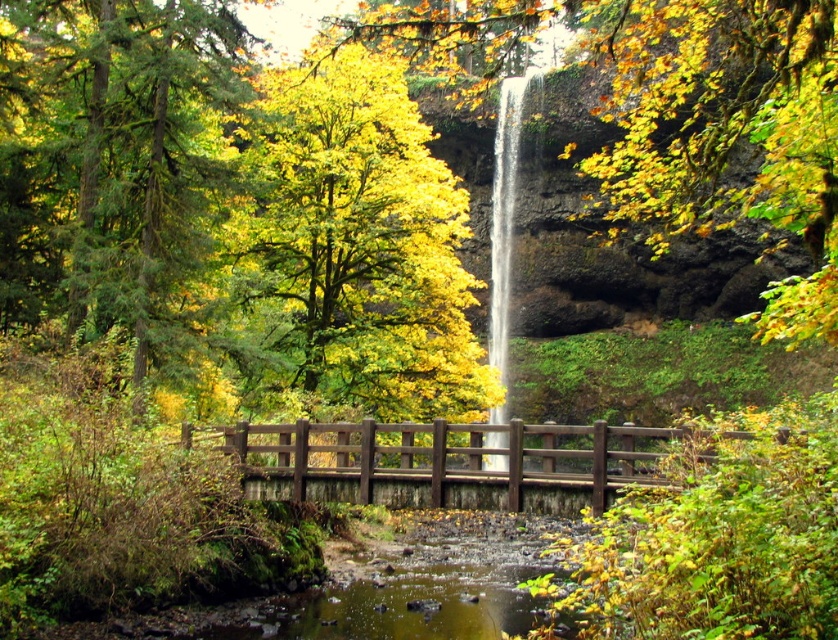
Question: Which point is farther to the camera?

Choices:
 (A) white smooth waterfall at center
 (B) yellow/golden leaves at center
 (C) yellow leafy tree at center
 (D) brown wooden bridge at center

Answer: (B)

Question: Which object is the closest to the brown wooden bridge at center?

Choices:
 (A) yellow/golden leaves at center
 (B) white smooth waterfall at center

Answer: (B)

Question: Does yellow leafy tree at center appear over white smooth waterfall at center?

Choices:
 (A) no
 (B) yes

Answer: (B)

Question: Is yellow leafy tree at center below brown wooden bridge at center?

Choices:
 (A) no
 (B) yes

Answer: (A)

Question: Does yellow leafy tree at center have a smaller size compared to yellow/golden leaves at center?

Choices:
 (A) yes
 (B) no

Answer: (B)

Question: Which object is farther from the camera taking this photo?

Choices:
 (A) green matte tree at upper left
 (B) yellow leafy tree at center
 (C) white smooth waterfall at center
 (D) brown wooden bridge at center

Answer: (A)